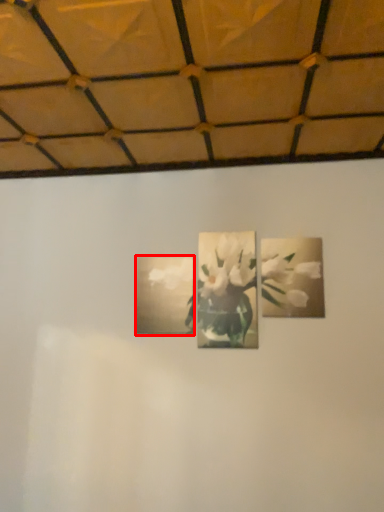
Question: Considering the relative positions of picture frame (annotated by the red box) and flower in the image provided, where is picture frame (annotated by the red box) located with respect to the staircase?

Choices:
 (A) left
 (B) right

Answer: (A)